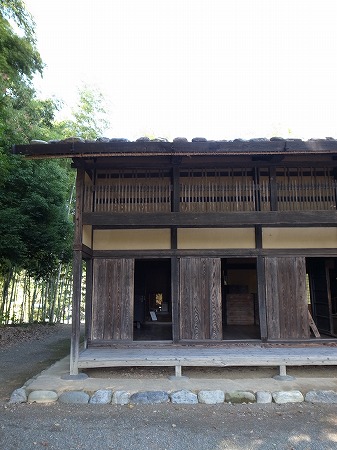
The image size is (337, 450). What are the coordinates of `sliding door` in the screenshot? It's located at (109, 313), (211, 311), (281, 306).